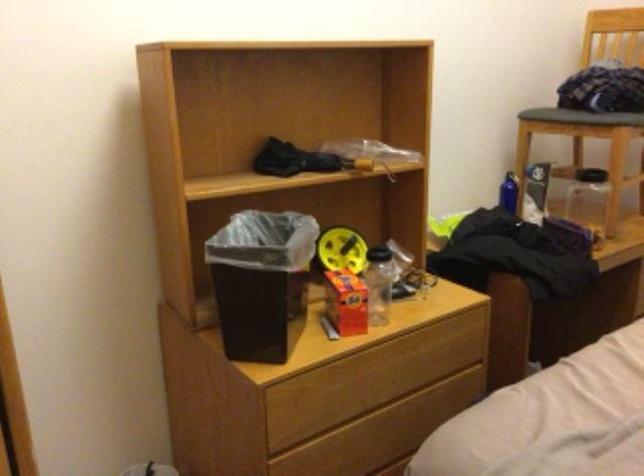
What are the coordinates of `orange cardboard box` in the screenshot? It's located at (346, 302).